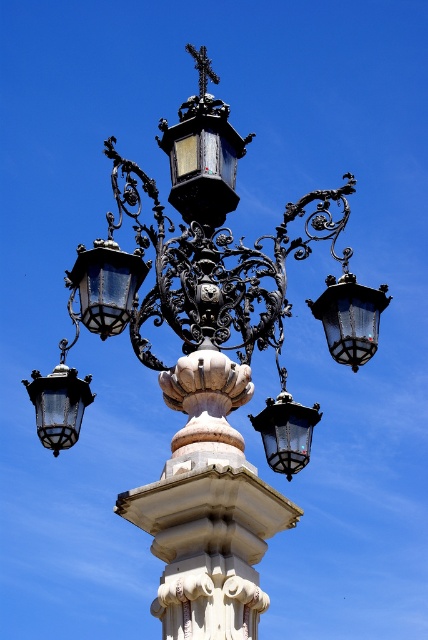
Which is more to the right, matte black lantern at upper left or matte black lantern at lower left?

matte black lantern at upper left

Between point (107, 216) and point (86, 403), which one is positioned in front?

Point (107, 216)

Is point (89, 300) farther from camera compared to point (41, 406)?

No.

Locate an element on the screen. This screenshot has height=640, width=428. matte black lantern at upper left is located at coordinates (104, 285).

Who is positioned more to the right, matte black lantern at upper left or matte black lantern at center?

Positioned to the right is matte black lantern at center.

Which is in front, point (82, 246) or point (291, 433)?

Point (82, 246) is in front.

The image size is (428, 640). Identify the location of matte black lantern at upper left. (104, 285).

Who is shorter, clear glass lantern at upper right or matte black lantern at center?

With less height is clear glass lantern at upper right.

Is clear glass lantern at upper right to the right of matte black lantern at center from the viewer's perspective?

Yes, clear glass lantern at upper right is to the right of matte black lantern at center.

This screenshot has height=640, width=428. What are the coordinates of `clear glass lantern at upper right` in the screenshot? It's located at (350, 316).